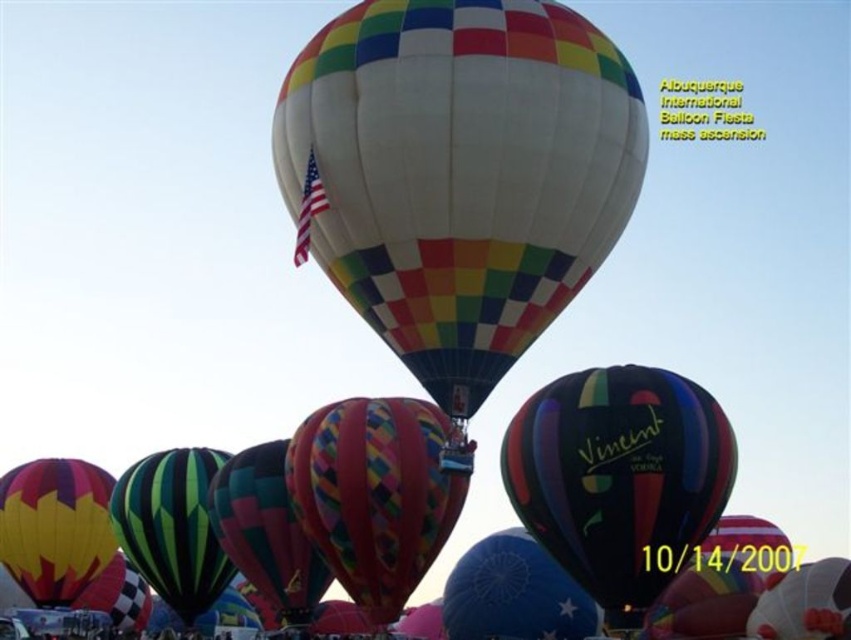
You are a photographer at the Albuquerque International Balloon Fiesta. You want to capture a photo where the multicolored fabric balloon at center is the main focus and the multicolored glossy balloon at center appears as a secondary element in the background. Is this arrangement possible based on their positions?

The multicolored fabric balloon at center is behind the multicolored glossy balloon at center, so yes, this arrangement is possible. The multicolored glossy balloon at center would naturally appear in the foreground, allowing the photographer to focus on the multicolored fabric balloon at center in the background as the main subject.

You are a photographer planning to capture the Albuquerque International Balloon Fiesta. You have a camera with a 50mm lens that can capture objects up to 3 meters wide. You see the multicolored glossy balloon at center and the multicolored fabric balloon at center. Can both balloons fit in your camera frame at the same time?

The multicolored glossy balloon at center is wider than the multicolored fabric balloon at center. Since the camera lens can capture up to 3 meters wide, you need to ensure the combined width of both balloons does not exceed this limit. However, without knowing their exact widths, it is impossible to confirm if they will both fit.